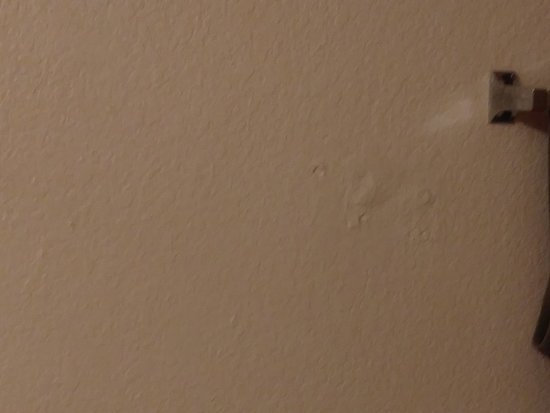
Find the location of a particular element. towel is located at coordinates (538, 336).